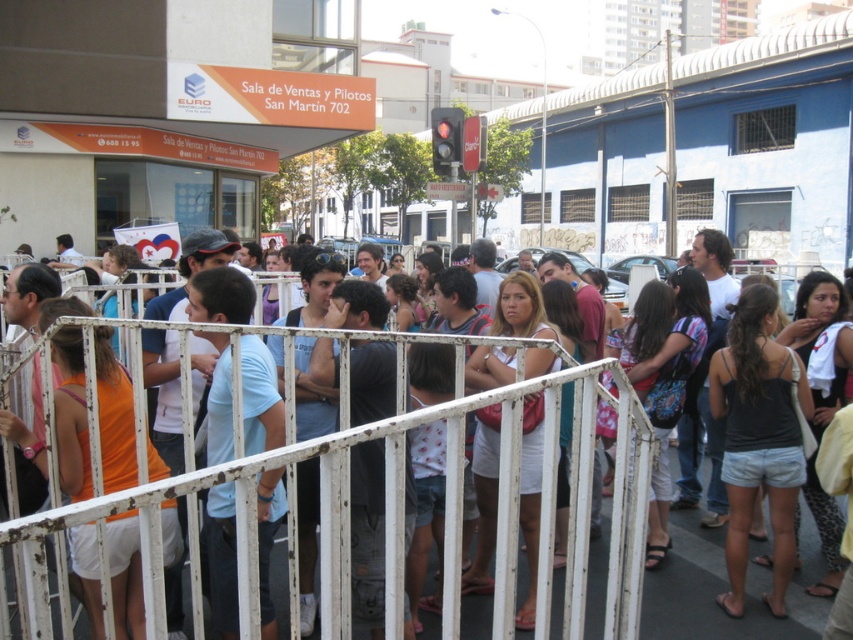
Is black denim shorts at center below white cotton dress at center?

Indeed, black denim shorts at center is positioned under white cotton dress at center.

In order to click on black denim shorts at center in this screenshot , I will do `click(758, 438)`.

Can you confirm if white metal rail at center is bigger than white cotton dress at center?

Yes, white metal rail at center is bigger than white cotton dress at center.

In the scene shown: Does white metal rail at center appear under white cotton dress at center?

No, white metal rail at center is not below white cotton dress at center.

Between point (498, 522) and point (509, 348), which one is positioned in front?

Positioned in front is point (498, 522).

Find the location of a particular element. The width and height of the screenshot is (853, 640). white metal rail at center is located at coordinates (399, 518).

Does point (158, 620) lie behind point (737, 432)?

No, (158, 620) is in front of (737, 432).

Does white metal rail at center have a larger size compared to black denim shorts at center?

Indeed, white metal rail at center has a larger size compared to black denim shorts at center.

What do you see at coordinates (399, 518) in the screenshot? This screenshot has width=853, height=640. I see `white metal rail at center` at bounding box center [399, 518].

The height and width of the screenshot is (640, 853). Identify the location of white metal rail at center. (399, 518).